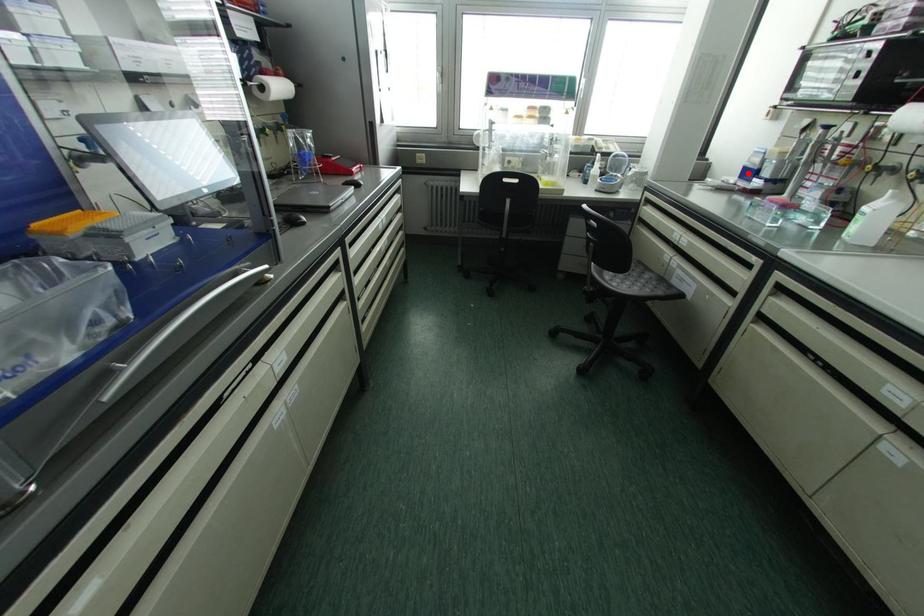
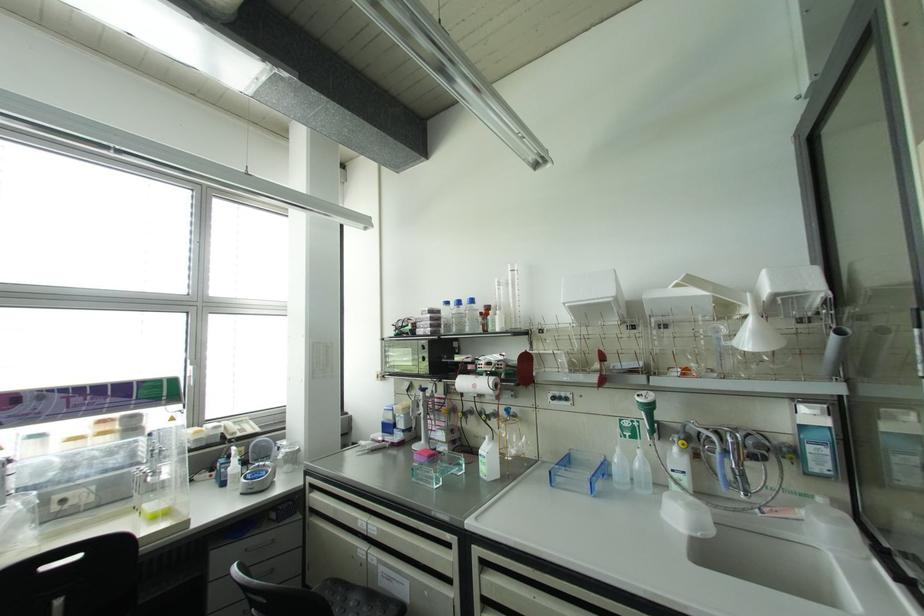
Question: A red point is marked in image1. In image2, is the corresponding 3D point closer to the camera or farther? Reply with the corresponding letter.

Choices:
 (A) The corresponding 3D point is closer.
 (B) The corresponding 3D point is farther.

Answer: (B)